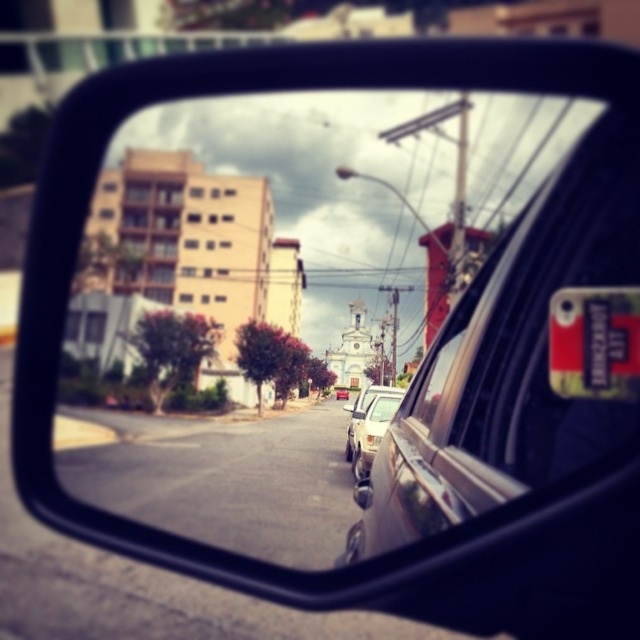
You are driving a car and want to check the position of the license plate relative to the car in the mirror. According to the scene, is the white plastic license plate at center located in front of or behind the white matte car at center?

The white plastic license plate at center is behind the white matte car at center.

You are a driver checking your side mirror and see the white matte car at center and the white plastic license plate at center. Which object is positioned lower in the reflection?

The white matte car at center is positioned lower than the white plastic license plate at center in the reflection.